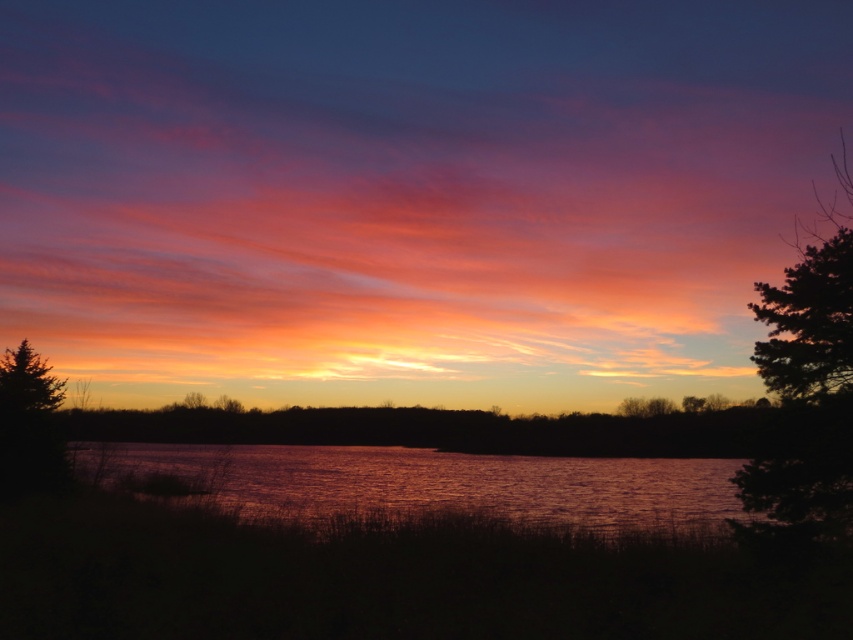
Question: Is green textured tree at right closer to camera compared to green matte tree at left?

Choices:
 (A) yes
 (B) no

Answer: (A)

Question: Can you confirm if green textured tree at right is wider than green matte tree at left?

Choices:
 (A) no
 (B) yes

Answer: (B)

Question: Which point is farther from the camera taking this photo?

Choices:
 (A) (814, 264)
 (B) (3, 364)
 (C) (846, 433)
 (D) (276, 467)

Answer: (D)

Question: Which object is closer to the camera taking this photo?

Choices:
 (A) green textured tree at right
 (B) shiny metallic water at center
 (C) green matte tree at left

Answer: (A)

Question: Which object appears closest to the camera in this image?

Choices:
 (A) silhouette tree at right
 (B) shiny metallic water at center
 (C) green matte tree at left

Answer: (A)

Question: Is shiny metallic water at center above silhouette tree at right?

Choices:
 (A) yes
 (B) no

Answer: (B)